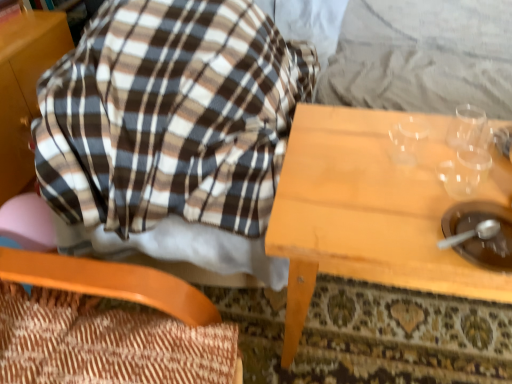
I want to click on vacant location below wooden table at center (from a real-world perspective), so click(410, 329).